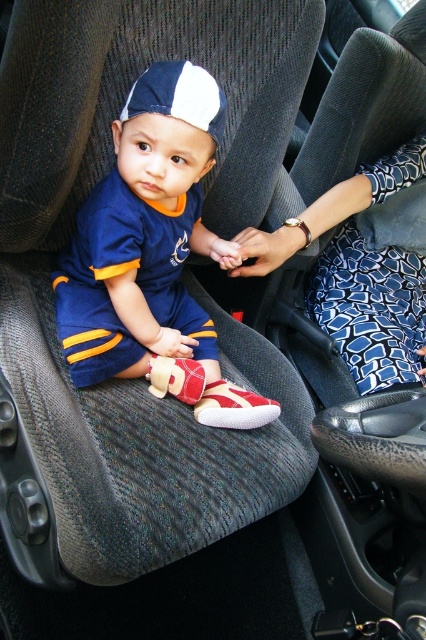
Question: Which object is closer to the camera taking this photo?

Choices:
 (A) white and navy blue fabric baseball cap at center
 (B) matte blue jersey at center
 (C) blue printed fabric at center

Answer: (A)

Question: Considering the relative positions of matte blue jersey at center and white and navy blue fabric baseball cap at center in the image provided, where is matte blue jersey at center located with respect to white and navy blue fabric baseball cap at center?

Choices:
 (A) left
 (B) right

Answer: (A)

Question: Which point appears farthest from the camera in this image?

Choices:
 (A) (204, 77)
 (B) (397, 365)
 (C) (89, 300)

Answer: (B)

Question: Does matte blue jersey at center appear under blue printed fabric at center?

Choices:
 (A) yes
 (B) no

Answer: (A)

Question: Which object appears farthest from the camera in this image?

Choices:
 (A) white and navy blue fabric baseball cap at center
 (B) blue printed fabric at center

Answer: (B)

Question: Where is blue printed fabric at center located in relation to white and navy blue fabric baseball cap at center in the image?

Choices:
 (A) left
 (B) right

Answer: (B)